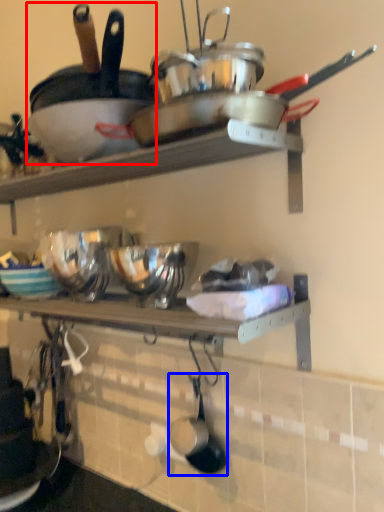
Question: Among these objects, which one is farthest to the camera, frying pan (highlighted by a red box) or frying pan (highlighted by a blue box)?

Choices:
 (A) frying pan
 (B) frying pan

Answer: (B)